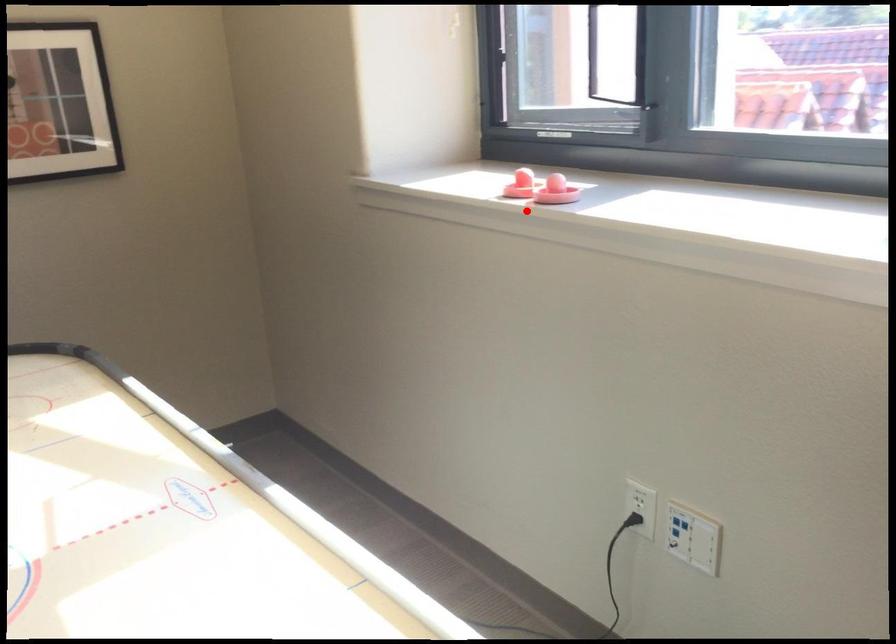
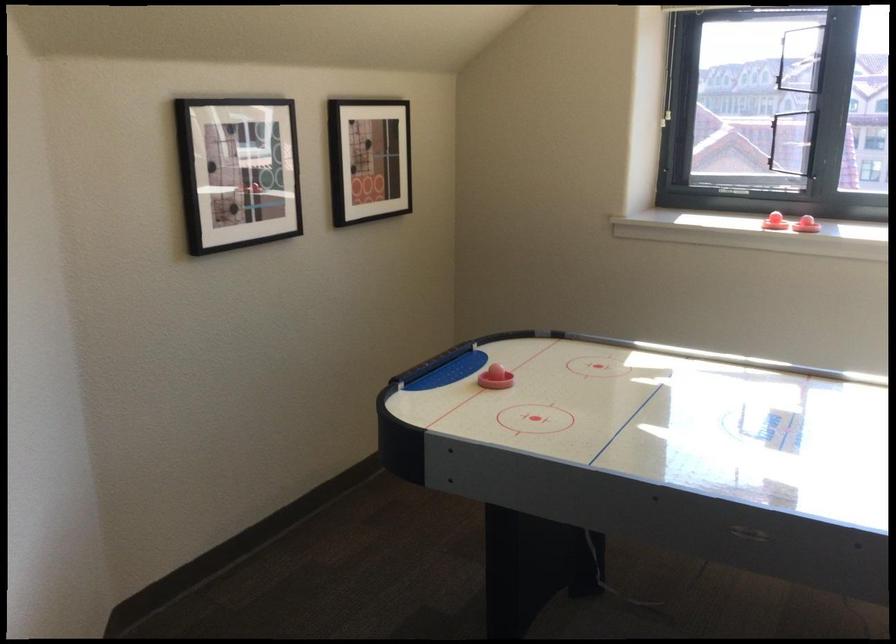
Question: I am providing you with two images of the same scene from different viewpoints. A red point is marked on the first image. Can you still see the location of the red point in image 2?

Choices:
 (A) Yes
 (B) No

Answer: (A)